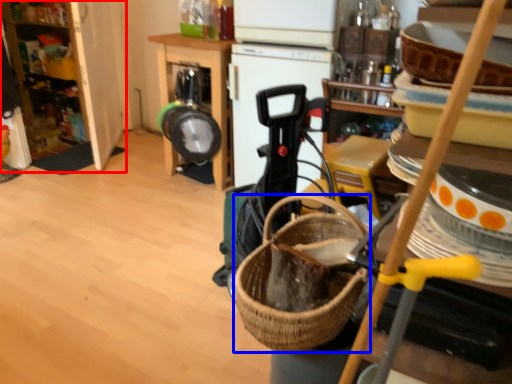
Question: Which point is further to the camera, cabinetry (highlighted by a red box) or basket (highlighted by a blue box)?

Choices:
 (A) cabinetry
 (B) basket

Answer: (A)